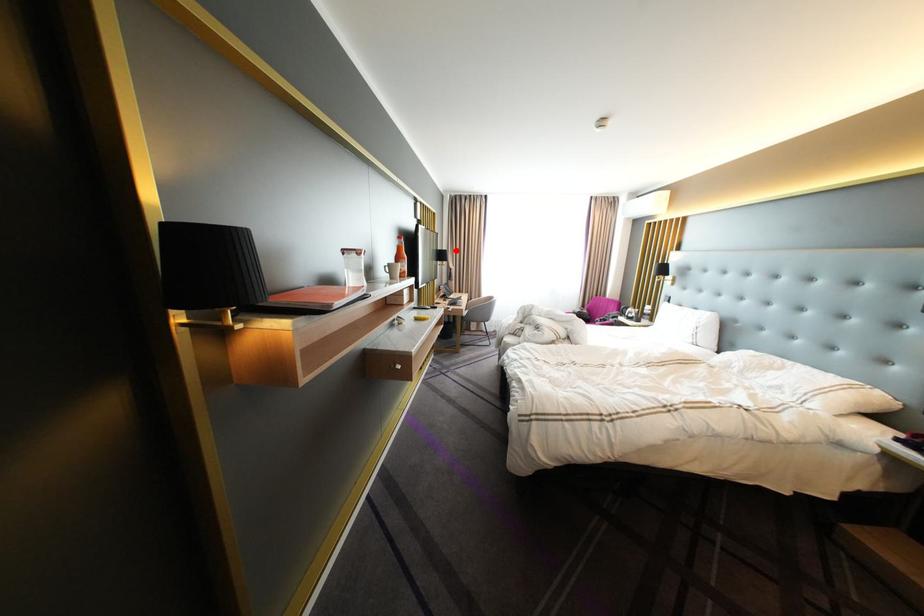
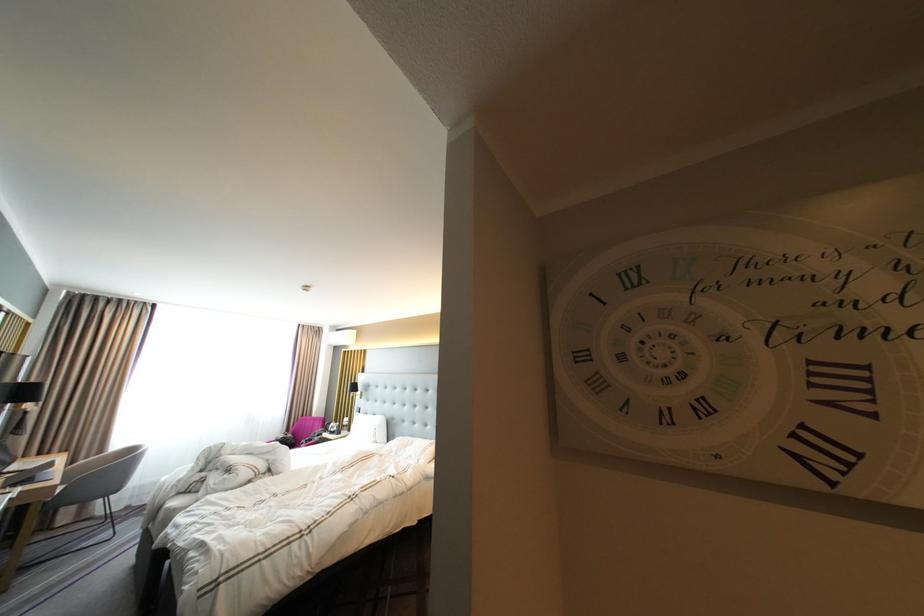
Find the pixel in the second image that matches the highlighted location in the first image.

(43, 381)